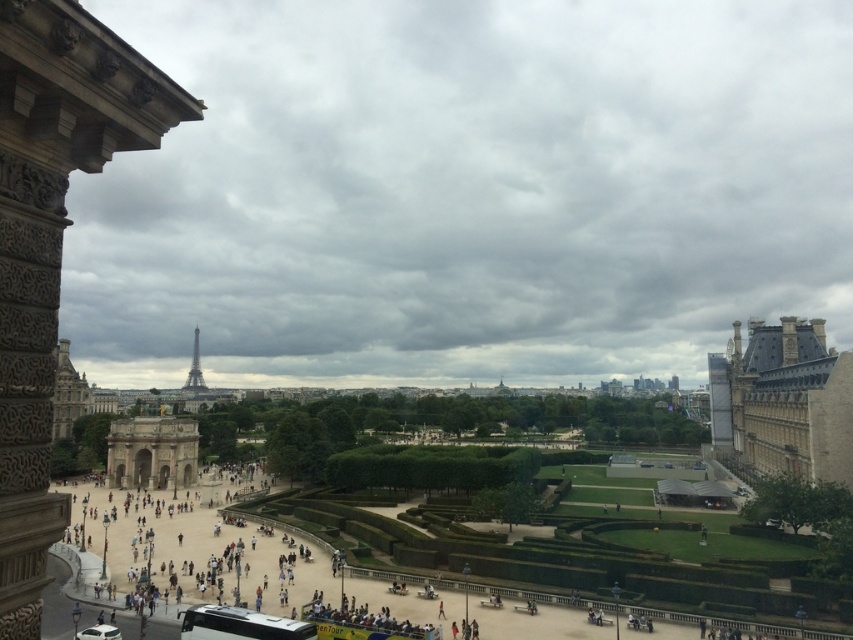
From the picture: You are standing in the park and see both the smooth stone tower at left and the shiny metallic eiffel tower at center. Which one is positioned to the right of the other?

The smooth stone tower at left is positioned to the right of the shiny metallic eiffel tower at center.

You are a tourist standing in the plaza and want to take a photo that includes both the brown stone building at right and the shiny metallic eiffel tower at center. Which object will appear larger in the photo?

The brown stone building at right will appear larger in the photo because it is much taller than the shiny metallic eiffel tower at center.

You are a tourist standing in the plaza and want to take a photo of the shiny metallic eiffel tower at center without the white metallic bus at lower center blocking the view. Which direction should you move to ensure the bus is out of frame?

The white metallic bus at lower center is positioned on the right side of the shiny metallic eiffel tower at center. To avoid the bus blocking the view, move to the left side of the current position so that the bus is no longer in the frame.